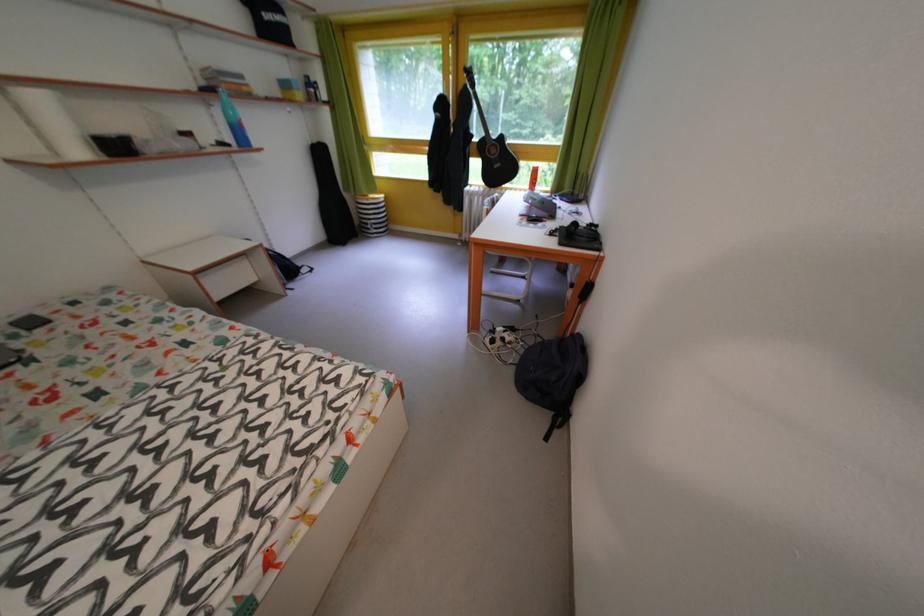
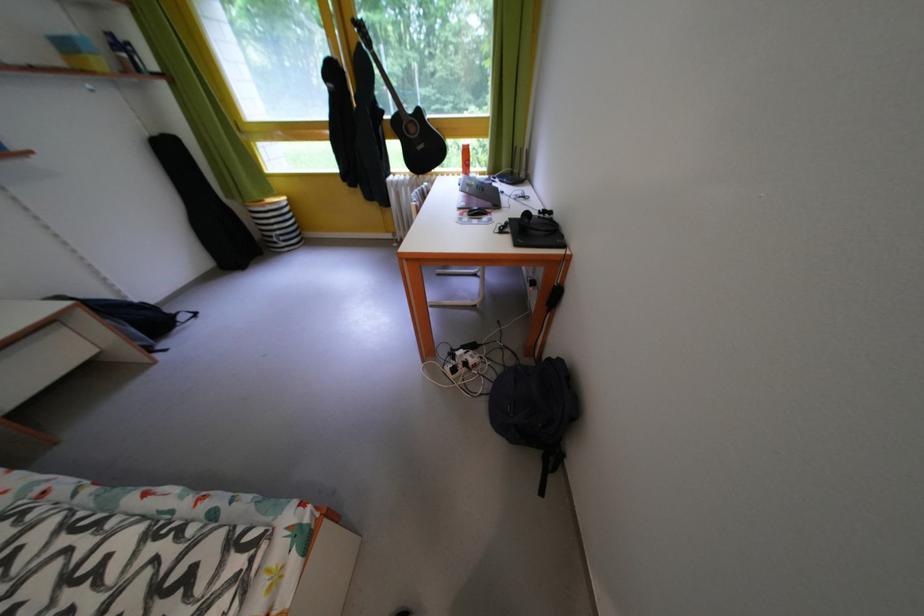
Where in the second image is the point corresponding to (324,147) from the first image?

(165, 139)